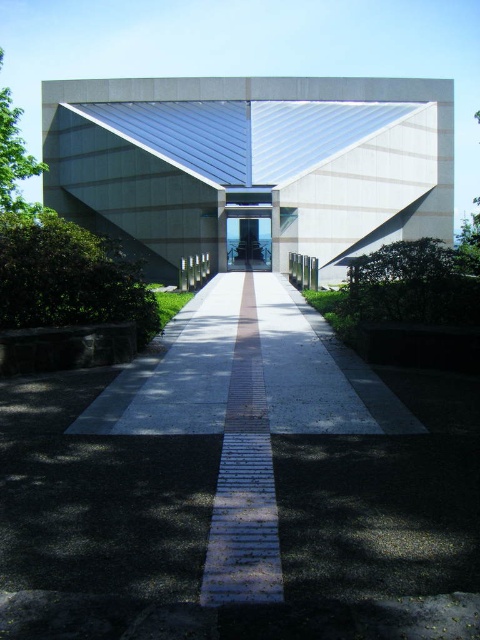
Does brick paved path at center appear on the right side of transparent glass door at center?

Incorrect, brick paved path at center is not on the right side of transparent glass door at center.

Can you confirm if brick paved path at center is positioned to the left of transparent glass door at center?

Correct, you'll find brick paved path at center to the left of transparent glass door at center.

Describe the element at coordinates (244, 481) in the screenshot. I see `brick paved path at center` at that location.

Locate an element on the screen. This screenshot has height=640, width=480. brick paved path at center is located at coordinates (244, 481).

Is white smooth concrete corridor at center smaller than brick paved path at center?

No.

Locate an element on the screen. This screenshot has width=480, height=640. white smooth concrete corridor at center is located at coordinates pos(252,163).

Consider the image. Does white smooth concrete corridor at center come behind transparent glass door at center?

No, white smooth concrete corridor at center is in front of transparent glass door at center.

Between white smooth concrete corridor at center and transparent glass door at center, which one appears on the right side from the viewer's perspective?

transparent glass door at center is more to the right.

What do you see at coordinates (252, 163) in the screenshot?
I see `white smooth concrete corridor at center` at bounding box center [252, 163].

Locate an element on the screen. Image resolution: width=480 pixels, height=640 pixels. white smooth concrete corridor at center is located at coordinates (252, 163).